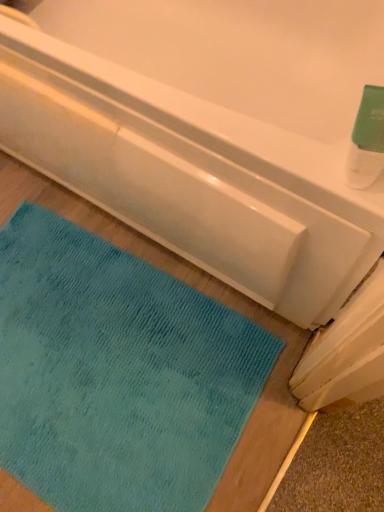
Question: Is matte white bathtub at upper center positioned in front of green matte bottle at upper right?

Choices:
 (A) yes
 (B) no

Answer: (B)

Question: Can you confirm if matte white bathtub at upper center is thinner than green matte bottle at upper right?

Choices:
 (A) yes
 (B) no

Answer: (B)

Question: Is matte white bathtub at upper center oriented away from green matte bottle at upper right?

Choices:
 (A) yes
 (B) no

Answer: (B)

Question: Could you tell me if matte white bathtub at upper center is turned towards green matte bottle at upper right?

Choices:
 (A) yes
 (B) no

Answer: (B)

Question: From a real-world perspective, is matte white bathtub at upper center positioned under green matte bottle at upper right based on gravity?

Choices:
 (A) yes
 (B) no

Answer: (A)

Question: Considering the positions of green matte bottle at upper right and teal plush mat at lower left in the image, is green matte bottle at upper right bigger or smaller than teal plush mat at lower left?

Choices:
 (A) big
 (B) small

Answer: (B)

Question: Is green matte bottle at upper right in front of or behind teal plush mat at lower left in the image?

Choices:
 (A) front
 (B) behind

Answer: (A)

Question: Would you say green matte bottle at upper right is inside or outside teal plush mat at lower left?

Choices:
 (A) inside
 (B) outside

Answer: (B)

Question: From a real-world perspective, is green matte bottle at upper right physically located above or below teal plush mat at lower left?

Choices:
 (A) above
 (B) below

Answer: (A)

Question: Looking at the image, does matte white bathtub at upper center seem bigger or smaller compared to green matte bottle at upper right?

Choices:
 (A) big
 (B) small

Answer: (A)

Question: Would you say matte white bathtub at upper center is inside or outside green matte bottle at upper right?

Choices:
 (A) inside
 (B) outside

Answer: (B)

Question: Considering the positions of point (107, 99) and point (362, 97), is point (107, 99) closer or farther from the camera than point (362, 97)?

Choices:
 (A) farther
 (B) closer

Answer: (A)

Question: From the image's perspective, relative to green matte bottle at upper right, is matte white bathtub at upper center above or below?

Choices:
 (A) below
 (B) above

Answer: (A)

Question: From the image's perspective, is teal plush mat at lower left positioned above or below green matte bottle at upper right?

Choices:
 (A) above
 (B) below

Answer: (B)

Question: Based on their positions, is teal plush mat at lower left located to the left or right of green matte bottle at upper right?

Choices:
 (A) left
 (B) right

Answer: (A)